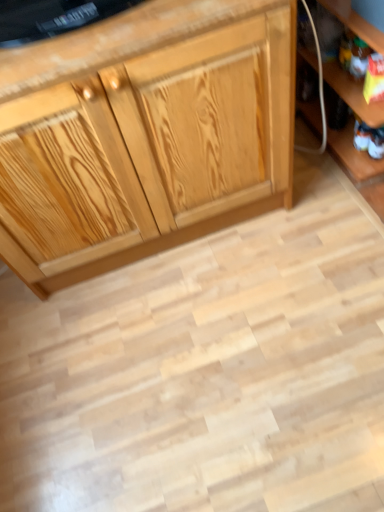
Question: Is natural wood cabinet at center wider or thinner than wooden shelf at lower right?

Choices:
 (A) thin
 (B) wide

Answer: (A)

Question: From their relative heights in the image, would you say natural wood cabinet at center is taller or shorter than wooden shelf at lower right?

Choices:
 (A) short
 (B) tall

Answer: (B)

Question: Which object is positioned closest to the wooden shelf at lower right?

Choices:
 (A) white fabric toy at lower right
 (B) natural wood cabinet at center

Answer: (A)

Question: Which of these objects is positioned closest to the white fabric toy at lower right?

Choices:
 (A) natural wood cabinet at center
 (B) wooden shelf at lower right

Answer: (B)